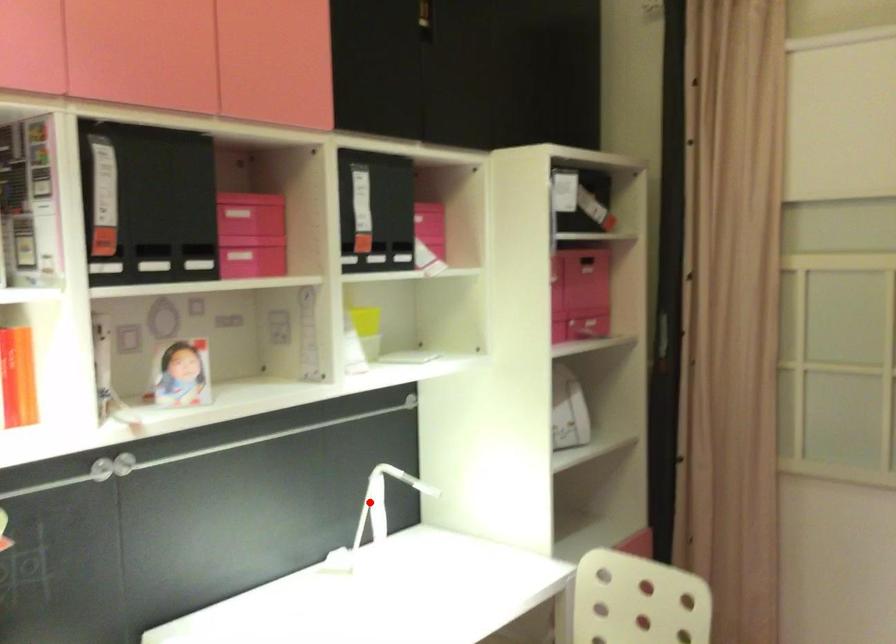
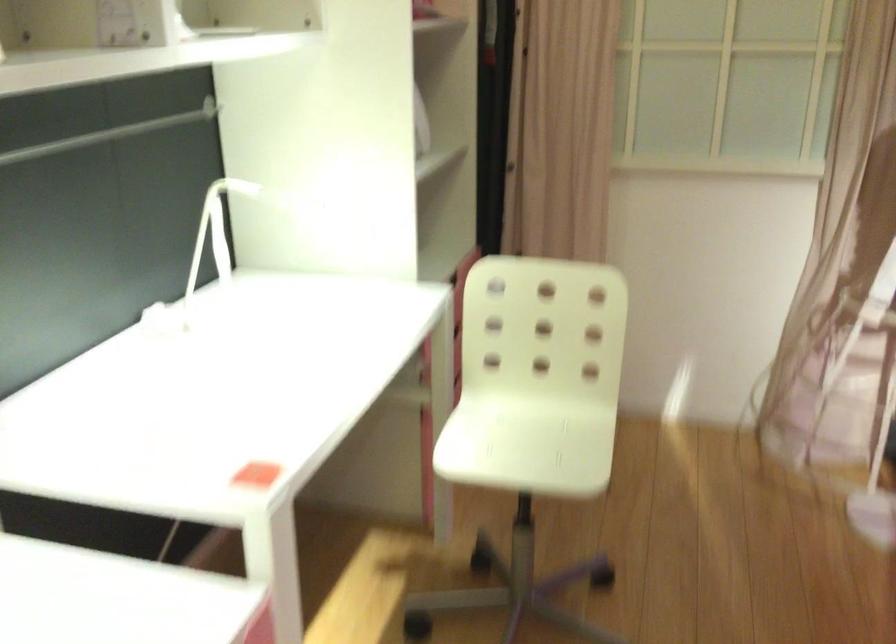
Question: I am providing you with two images of the same scene from different viewpoints. In image1, a red point is highlighted. Considering the same 3D point in image2, which of the following is correct?

Choices:
 (A) It is closer
 (B) It is farther

Answer: (A)